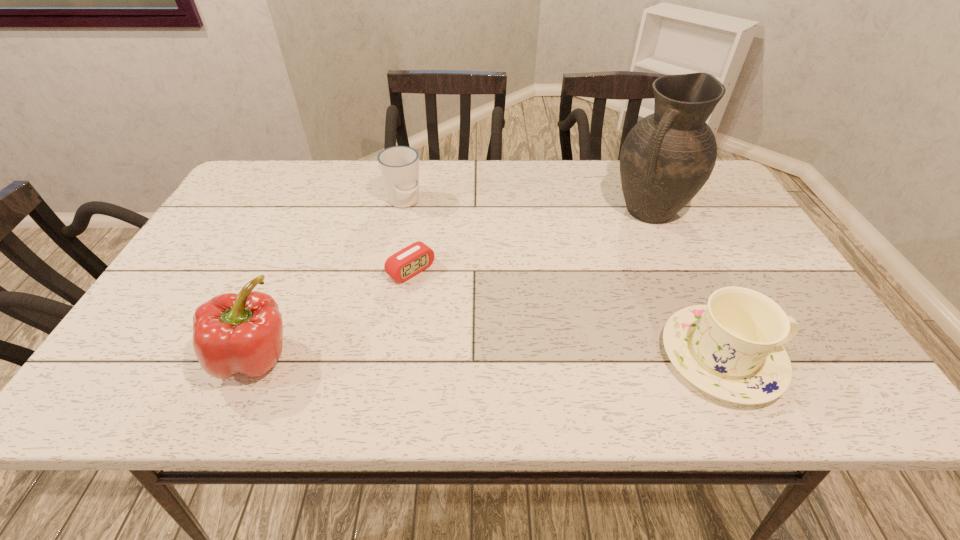
The height and width of the screenshot is (540, 960). I want to click on chinaware present at the near edge, so click(x=732, y=348).

Where is `chinaware located in the right edge section of the desktop`? The image size is (960, 540). chinaware located in the right edge section of the desktop is located at coordinates (732, 348).

The image size is (960, 540). Identify the location of pitcher present at the right edge. (667, 157).

Locate an element on the screen. The image size is (960, 540). object that is at the far right corner is located at coordinates (667, 157).

At what (x,y) coordinates should I click in order to perform the action: click on object that is at the near right corner. Please return your answer as a coordinate pair (x, y). The image size is (960, 540). Looking at the image, I should click on (732, 348).

In the image, there is a desktop. Where is `free space at the far edge`? The image size is (960, 540). free space at the far edge is located at coordinates (302, 176).

The height and width of the screenshot is (540, 960). In the image, there is a desktop. Find the location of `blank space at the near edge`. blank space at the near edge is located at coordinates coord(504,329).

At what (x,y) coordinates should I click in order to perform the action: click on vacant space at the left edge of the desktop. Please return your answer as a coordinate pair (x, y). The height and width of the screenshot is (540, 960). Looking at the image, I should click on (219, 222).

Locate an element on the screen. The width and height of the screenshot is (960, 540). free region at the right edge of the desktop is located at coordinates (756, 236).

Locate an element on the screen. free area in between the pepper and the third nearest object is located at coordinates 333,313.